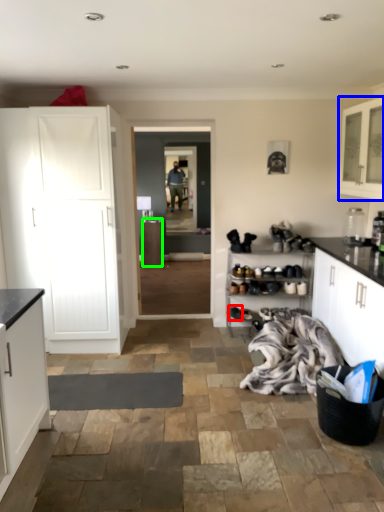
Question: Which object is positioned closest to footwear (highlighted by a red box)? Select from cabinetry (highlighted by a blue box) and cabinetry (highlighted by a green box).

Choices:
 (A) cabinetry
 (B) cabinetry

Answer: (A)